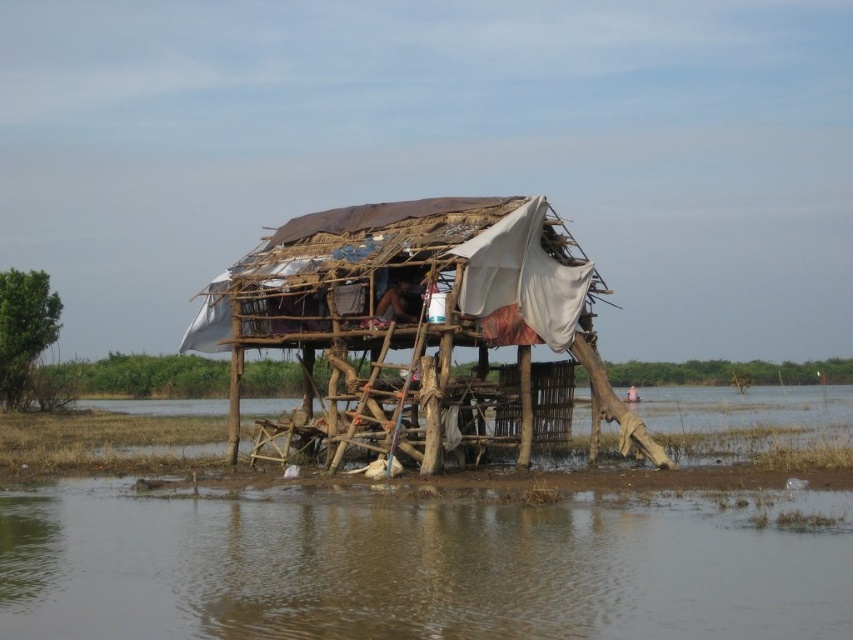
You are standing in front of the flooded area shelter and want to place a heavy object between the two points, point [720,605] and point [332,392]. Which point should you place it closer to so that it appears larger in the image?

You should place the heavy object closer to point [720,605] because it is closer to the viewer than point [332,392], making it appear larger in the image.

You are a relief worker assessing the flooded area. You see the brown muddy water at lower center and the rusty wood shack at center. Which object takes up more space in the image?

The rusty wood shack at center takes up more space in the image because the brown muddy water at lower center is smaller than it.